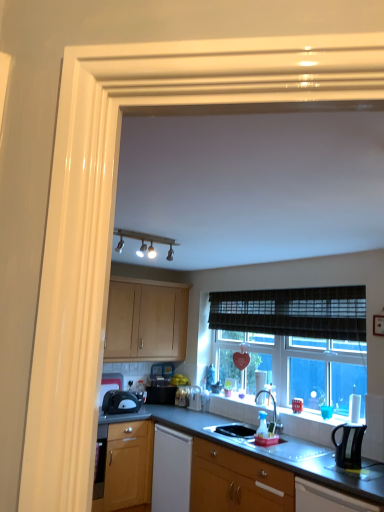
Describe the element at coordinates (349, 445) in the screenshot. This screenshot has width=384, height=512. I see `black plastic kettle at right, positioned as the 1th kitchen appliance in front-to-back order` at that location.

I want to click on light wood cabinet at center, which is the 3th cabinetry from front to back, so click(x=146, y=322).

Locate an element on the screen. translucent plastic bottle at sink is located at coordinates (262, 425).

What is the approximate height of clear plastic bottle at center?

8.95 inches.

This screenshot has height=512, width=384. What do you see at coordinates (194, 398) in the screenshot? I see `clear plastic bottle at center` at bounding box center [194, 398].

The image size is (384, 512). I want to click on black plastic kettle at right, positioned as the 1th kitchen appliance in front-to-back order, so click(349, 445).

Which is behind, wooden cabinet at lower center, which is the 2th cabinetry in back-to-front order, or black matte sink at center, marked as the second sink in a front-to-back arrangement?

black matte sink at center, marked as the second sink in a front-to-back arrangement, is behind.

Based on their sizes in the image, would you say wooden cabinet at lower center, the third cabinetry in the top-to-bottom sequence, is bigger or smaller than black matte sink at center, positioned as the first sink in back-to-front order?

Clearly, wooden cabinet at lower center, the third cabinetry in the top-to-bottom sequence, is larger in size than black matte sink at center, positioned as the first sink in back-to-front order.

Does wooden cabinet at lower center, which is the 2th cabinetry in back-to-front order, have a greater height compared to black matte sink at center, positioned as the first sink in back-to-front order?

Yes, wooden cabinet at lower center, which is the 2th cabinetry in back-to-front order, is taller than black matte sink at center, positioned as the first sink in back-to-front order.

Looking at their sizes, would you say wooden cabinet at lower center, the third cabinetry in the top-to-bottom sequence, is wider or thinner than black matte sink at center, positioned as the first sink in back-to-front order?

In the image, wooden cabinet at lower center, the third cabinetry in the top-to-bottom sequence, appears to be wider than black matte sink at center, positioned as the first sink in back-to-front order.

Who is bigger, matte black toaster at lower left, the 1th kitchen appliance when ordered from left to right, or matte white track lights at upper center?

With larger size is matte white track lights at upper center.

Looking at this image, does matte black toaster at lower left, which is the second kitchen appliance in right-to-left order, have a lesser width compared to matte white track lights at upper center?

Incorrect, the width of matte black toaster at lower left, which is the second kitchen appliance in right-to-left order, is not less than that of matte white track lights at upper center.

From a real-world perspective, which is physically above, matte black toaster at lower left, which is counted as the 1th kitchen appliance, starting from the back, or matte white track lights at upper center?

matte white track lights at upper center, from a real-world perspective.

Is black plastic kettle at right, placed as the second kitchen appliance when sorted from left to right, turned away from matte white track lights at upper center?

That's not correct — black plastic kettle at right, placed as the second kitchen appliance when sorted from left to right, is not looking away from matte white track lights at upper center.

From the image's perspective, does black plastic kettle at right, arranged as the 2th kitchen appliance when viewed from the back, appear lower than matte white track lights at upper center?

Yes, from the image's perspective, black plastic kettle at right, arranged as the 2th kitchen appliance when viewed from the back, is below matte white track lights at upper center.

From a real-world perspective, which object stands above the other?

From a 3D spatial view, matte white track lights at upper center is above.

Find the location of a particular element. kitchen appliance that appears on the right of matte white track lights at upper center is located at coordinates (349, 445).

Which is more to the left, black woven curtain at center or white glossy sink at lower center, the 1th sink from the front?

Positioned to the left is white glossy sink at lower center, the 1th sink from the front.

From the picture: From a real-world perspective, is black woven curtain at center physically above white glossy sink at lower center, the 1th sink from the front?

Indeed, from a real-world perspective, black woven curtain at center stands above white glossy sink at lower center, the 1th sink from the front.

Considering the positions of points (265, 308) and (267, 411), is point (265, 308) farther from camera compared to point (267, 411)?

Yes, point (265, 308) is behind point (267, 411).

In the scene shown: Considering the relative positions of black woven curtain at center and white glossy sink at lower center, the 1th sink from the front, in the image provided, is black woven curtain at center behind white glossy sink at lower center, the 1th sink from the front,?

Yes, black woven curtain at center is behind white glossy sink at lower center, the 1th sink from the front.

Is matte black toaster at lower right, which is the second cabinetry from bottom to top, positioned in front of black plastic kettle at right, positioned as the 1th kitchen appliance in front-to-back order?

Yes, matte black toaster at lower right, which is the second cabinetry from bottom to top, is closer to the viewer.

Find the location of a particular element. This screenshot has width=384, height=512. the 1st kitchen appliance counting from the left side of the matte black toaster at lower right, placed as the 3th cabinetry when sorted from back to front is located at coordinates (349, 445).

Based on their positions, is matte black toaster at lower right, the 1th cabinetry positioned from the right, located to the left or right of black plastic kettle at right, positioned as the 1th kitchen appliance in front-to-back order?

matte black toaster at lower right, the 1th cabinetry positioned from the right, is to the right of black plastic kettle at right, positioned as the 1th kitchen appliance in front-to-back order.

Looking at this image, is matte black toaster at lower right, the 1th cabinetry positioned from the right, surrounding black plastic kettle at right, arranged as the 2th kitchen appliance when viewed from the back?

Actually, black plastic kettle at right, arranged as the 2th kitchen appliance when viewed from the back, is outside matte black toaster at lower right, the 1th cabinetry positioned from the right.

From the image's perspective, which is above, black woven curtain at center or matte white track lights at upper center?

matte white track lights at upper center is shown above in the image.

Which is behind, point (310, 331) or point (114, 230)?

The point (310, 331) is farther.

Is black woven curtain at center positioned behind matte white track lights at upper center?

Yes, black woven curtain at center is further from the viewer.

Considering the sizes of objects black woven curtain at center and matte white track lights at upper center in the image provided, who is smaller, black woven curtain at center or matte white track lights at upper center?

matte white track lights at upper center.

Is black woven curtain at center in contact with wooden cabinet at lower center, the 1th cabinetry from the bottom?

black woven curtain at center and wooden cabinet at lower center, the 1th cabinetry from the bottom, are clearly separated.

Between black woven curtain at center and wooden cabinet at lower center, which is the second cabinetry from right to left, which one has less height?

Standing shorter between the two is black woven curtain at center.

From the image's perspective, is black woven curtain at center on wooden cabinet at lower center, which is the 2th cabinetry in back-to-front order?

Yes, from the image's perspective, black woven curtain at center is above wooden cabinet at lower center, which is the 2th cabinetry in back-to-front order.

From a real-world perspective, who is located lower, black woven curtain at center or wooden cabinet at lower center, which is the 2th cabinetry in back-to-front order?

wooden cabinet at lower center, which is the 2th cabinetry in back-to-front order.

From the image's perspective, count 1st sinks upward from the wooden cabinet at lower center, the 2th cabinetry positioned from the front, and point to it. Please provide its 2D coordinates.

[(233, 430)]

Where is `kitchen appliance that appears on the left of matte white track lights at upper center`? kitchen appliance that appears on the left of matte white track lights at upper center is located at coordinates (120, 402).

Based on their spatial positions, is matte white track lights at upper center or wooden cabinet at lower center, the 2th cabinetry positioned from the front, closer to clear plastic bottle at center?

wooden cabinet at lower center, the 2th cabinetry positioned from the front, lies closer to clear plastic bottle at center than the other object.

Estimate the real-world distances between objects in this image. Which object is further from black matte sink at center, marked as the second sink in a front-to-back arrangement, matte black toaster at lower right, the 2th cabinetry in the top-to-bottom sequence, or wooden cabinet at lower center, placed as the 2th cabinetry when sorted from left to right?

Based on the image, matte black toaster at lower right, the 2th cabinetry in the top-to-bottom sequence, appears to be further to black matte sink at center, marked as the second sink in a front-to-back arrangement.

When comparing their distances from matte black toaster at lower left, which is the second kitchen appliance in right-to-left order, does matte white track lights at upper center or clear plastic bottle at center seem further?

matte white track lights at upper center is positioned further to the anchor matte black toaster at lower left, which is the second kitchen appliance in right-to-left order.

Considering their positions, is light wood cabinet at center, the first cabinetry positioned from the back, positioned further to satin nickel faucet at center than white glossy sink at lower center, the 1th sink from the front?

light wood cabinet at center, the first cabinetry positioned from the back.

Estimate the real-world distances between objects in this image. Which object is further from translucent plastic bottle at sink, black plastic kettle at right, marked as the first kitchen appliance in a right-to-left arrangement, or clear plastic bottle at center?

Based on the image, clear plastic bottle at center appears to be further to translucent plastic bottle at sink.

From the image, which object appears to be nearer to black woven curtain at center, matte black toaster at lower right, which is the 1th cabinetry from front to back, or matte black toaster at lower left, which is the second kitchen appliance in right-to-left order?

The object closer to black woven curtain at center is matte black toaster at lower right, which is the 1th cabinetry from front to back.

From the image, which object appears to be farther from black plastic kettle at right, arranged as the 2th kitchen appliance when viewed from the back, black woven curtain at center or matte black toaster at lower left, the 1th kitchen appliance when ordered from left to right?

Based on the image, matte black toaster at lower left, the 1th kitchen appliance when ordered from left to right, appears to be further to black plastic kettle at right, arranged as the 2th kitchen appliance when viewed from the back.

Which object lies further to the anchor point matte black toaster at lower right, the 1th cabinetry positioned from the right, wooden cabinet at lower center, the third cabinetry in the top-to-bottom sequence, or matte white track lights at upper center?

Based on the image, matte white track lights at upper center appears to be further to matte black toaster at lower right, the 1th cabinetry positioned from the right.

Locate an element on the screen. This screenshot has width=384, height=512. tap between black woven curtain at center and black matte sink at center, positioned as the first sink in back-to-front order, vertically is located at coordinates (274, 408).

At what (x,y) coordinates should I click in order to perform the action: click on cabinetry between translucent plastic bottle at sink and clear plastic bottle at center from front to back. Please return your answer as a coordinate pair (x, y). The height and width of the screenshot is (512, 384). Looking at the image, I should click on (146, 322).

Find the location of a particular element. This screenshot has height=512, width=384. light fixture positioned between black plastic kettle at right, arranged as the 2th kitchen appliance when viewed from the back, and clear plastic bottle at center from near to far is located at coordinates (144, 242).

The width and height of the screenshot is (384, 512). I want to click on sink between matte black toaster at lower left, which is counted as the 1th kitchen appliance, starting from the back, and translucent plastic bottle at sink, in the horizontal direction, so click(x=233, y=430).